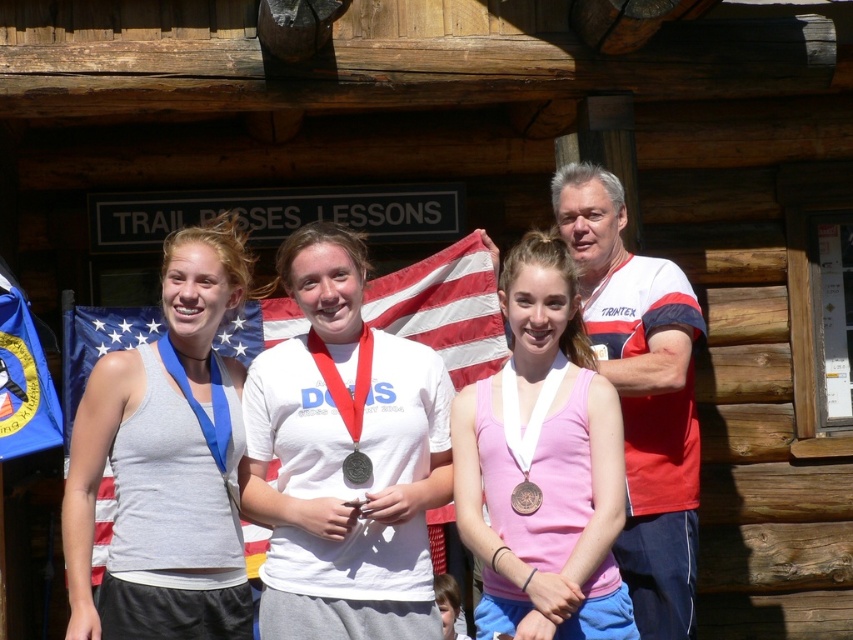
Is white jersey at center positioned in front of gold metallic medal at center?

No, it is behind gold metallic medal at center.

Who is positioned more to the right, white jersey at center or gold metallic medal at center?

From the viewer's perspective, white jersey at center appears more on the right side.

Who is more distant from viewer, (656, 314) or (538, 502)?

Point (656, 314)

Where is `white jersey at center`? white jersey at center is located at coordinates (641, 394).

Does white jersey at center have a lesser height compared to white cotton shirt at center?

Yes, white jersey at center is shorter than white cotton shirt at center.

Between point (689, 627) and point (693, 444), which one is positioned behind?

The point (693, 444) is behind.

Locate an element on the screen. The image size is (853, 640). white jersey at center is located at coordinates (641, 394).

Is matte gray tank top at center to the left of white cotton shirt at center from the viewer's perspective?

Yes, matte gray tank top at center is to the left of white cotton shirt at center.

Is matte gray tank top at center in front of white cotton shirt at center?

Yes, matte gray tank top at center is closer to the viewer.

Between point (181, 493) and point (657, 534), which one is positioned behind?

Positioned behind is point (657, 534).

Locate an element on the screen. matte gray tank top at center is located at coordinates (166, 461).